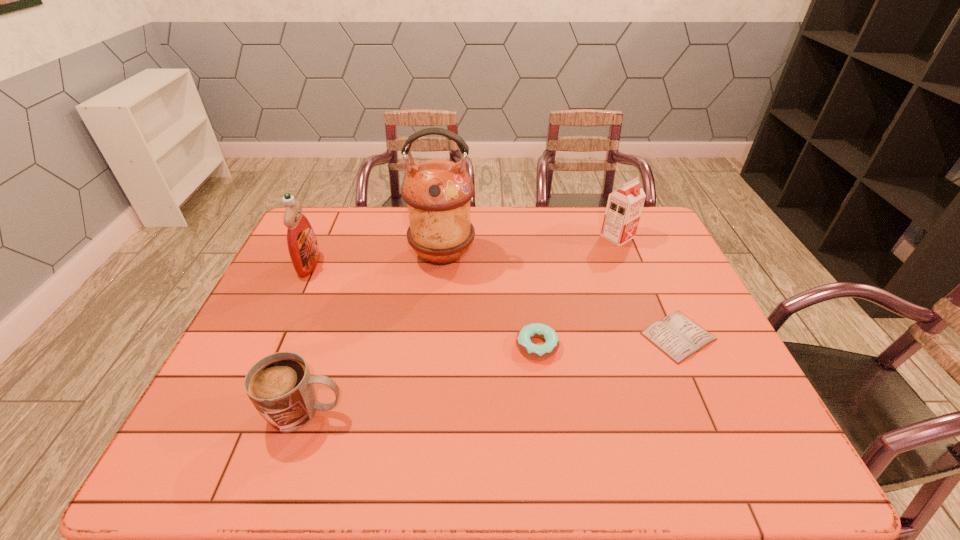
At what (x,y) coordinates should I click in order to perform the action: click on vacant space located on the front surface of the leftmost object. Please return your answer as a coordinate pair (x, y). This screenshot has width=960, height=540. Looking at the image, I should click on (342, 264).

This screenshot has height=540, width=960. What are the coordinates of `vacant space situated on the left of the fourth shortest object` in the screenshot? It's located at (565, 237).

This screenshot has width=960, height=540. Find the location of `vacant position located 0.080m on the side of the fifth object from right to left with the handle`. vacant position located 0.080m on the side of the fifth object from right to left with the handle is located at coordinates (381, 411).

This screenshot has height=540, width=960. What are the coordinates of `vacant area situated on the right of the second shortest object` in the screenshot? It's located at (636, 346).

The height and width of the screenshot is (540, 960). I want to click on vacant region located on the back of the shortest object, so click(647, 267).

Locate an element on the screen. The height and width of the screenshot is (540, 960). oil lamp at the far edge is located at coordinates (438, 192).

At what (x,y) coordinates should I click in order to perform the action: click on soya milk that is at the far edge. Please return your answer as a coordinate pair (x, y). The width and height of the screenshot is (960, 540). Looking at the image, I should click on (624, 206).

The width and height of the screenshot is (960, 540). What are the coordinates of `object that is at the near edge` in the screenshot? It's located at (280, 386).

Where is `detergent present at the left edge`? The image size is (960, 540). detergent present at the left edge is located at coordinates (302, 244).

Identify the location of mug that is positioned at the left edge. (280, 386).